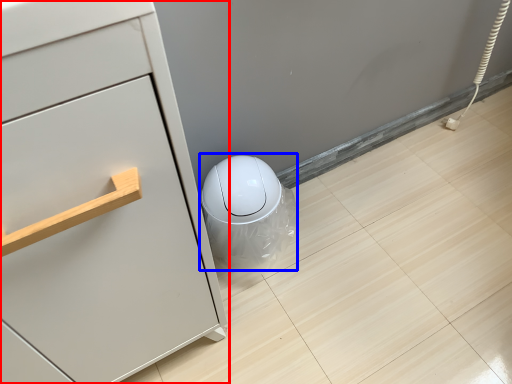
Question: Among these objects, which one is farthest to the camera, chest of drawers (highlighted by a red box) or porcelain (highlighted by a blue box)?

Choices:
 (A) chest of drawers
 (B) porcelain

Answer: (B)